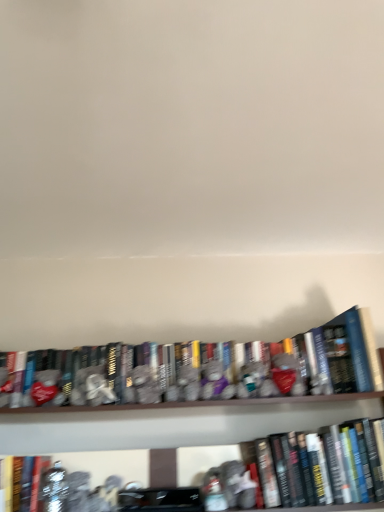
What do you see at coordinates (24, 479) in the screenshot?
I see `hardcover book at lower left, placed as the 3th book when sorted from right to left` at bounding box center [24, 479].

The image size is (384, 512). Identify the location of hardcover books at center, which ranks as the 2th book in right-to-left order. (348, 356).

Find the location of a particular element. hardcover book at center, which appears as the first book when viewed from the right is located at coordinates (330, 453).

Can you confirm if hardcover book at center, which appears as the first book when viewed from the right, is bigger than hardcover book at lower left, marked as the first book in a left-to-right arrangement?

Correct, hardcover book at center, which appears as the first book when viewed from the right, is larger in size than hardcover book at lower left, marked as the first book in a left-to-right arrangement.

From their relative heights in the image, would you say hardcover book at center, the third book when ordered from left to right, is taller or shorter than hardcover book at lower left, marked as the first book in a left-to-right arrangement?

In the image, hardcover book at center, the third book when ordered from left to right, appears to be taller than hardcover book at lower left, marked as the first book in a left-to-right arrangement.

From a real-world perspective, does hardcover book at center, which appears as the first book when viewed from the right, sit lower than hardcover book at lower left, placed as the 3th book when sorted from right to left?

No.

From the image's perspective, would you say hardcover book at center, which appears as the first book when viewed from the right, is positioned over hardcover book at lower left, placed as the 3th book when sorted from right to left?

Yes, from the image's perspective, hardcover book at center, which appears as the first book when viewed from the right, is on top of hardcover book at lower left, placed as the 3th book when sorted from right to left.

From the picture: From the image's perspective, relative to hardcover books at center, which ranks as the 2th book in right-to-left order, is hardcover book at center, the third book when ordered from left to right, above or below?

From the image's perspective, hardcover book at center, the third book when ordered from left to right, appears below hardcover books at center, which ranks as the 2th book in right-to-left order.

Who is taller, hardcover book at center, which appears as the first book when viewed from the right, or hardcover books at center, the second book from the left?

hardcover book at center, which appears as the first book when viewed from the right.

Is hardcover book at center, the third book when ordered from left to right, facing towards hardcover books at center, the second book from the left?

No, hardcover book at center, the third book when ordered from left to right, is not oriented towards hardcover books at center, the second book from the left.

Between hardcover book at center, the third book when ordered from left to right, and hardcover books at center, which ranks as the 2th book in right-to-left order, which one appears on the right side from the viewer's perspective?

From the viewer's perspective, hardcover book at center, the third book when ordered from left to right, appears more on the right side.

Is hardcover book at lower left, marked as the first book in a left-to-right arrangement, positioned before hardcover books at center, which ranks as the 2th book in right-to-left order?

Yes, it is.

Is hardcover book at lower left, marked as the first book in a left-to-right arrangement, beside hardcover books at center, the second book from the left?

No, hardcover book at lower left, marked as the first book in a left-to-right arrangement, is not in contact with hardcover books at center, the second book from the left.

Where is `the 2nd book behind when counting from the hardcover book at lower left, placed as the 3th book when sorted from right to left`? The height and width of the screenshot is (512, 384). the 2nd book behind when counting from the hardcover book at lower left, placed as the 3th book when sorted from right to left is located at coordinates (348, 356).

From the image's perspective, is hardcover book at lower left, marked as the first book in a left-to-right arrangement, located beneath hardcover book at center, the third book when ordered from left to right?

Indeed, from the image's perspective, hardcover book at lower left, marked as the first book in a left-to-right arrangement, is shown beneath hardcover book at center, the third book when ordered from left to right.

Would you say hardcover book at lower left, marked as the first book in a left-to-right arrangement, is a long distance from hardcover book at center, which appears as the first book when viewed from the right?

hardcover book at lower left, marked as the first book in a left-to-right arrangement, is actually quite close to hardcover book at center, which appears as the first book when viewed from the right.

At what (x,y) coordinates should I click in order to perform the action: click on book below the hardcover book at center, the third book when ordered from left to right (from a real-world perspective). Please return your answer as a coordinate pair (x, y). Looking at the image, I should click on (24, 479).

Which is farther, (18, 498) or (339, 478)?

Positioned behind is point (339, 478).

Is there a large distance between hardcover books at center, the second book from the left, and hardcover book at lower left, placed as the 3th book when sorted from right to left?

No, there isn't a large distance between hardcover books at center, the second book from the left, and hardcover book at lower left, placed as the 3th book when sorted from right to left.

Does hardcover books at center, which ranks as the 2th book in right-to-left order, have a smaller size compared to hardcover book at lower left, placed as the 3th book when sorted from right to left?

Incorrect, hardcover books at center, which ranks as the 2th book in right-to-left order, is not smaller in size than hardcover book at lower left, placed as the 3th book when sorted from right to left.

Is hardcover books at center, the second book from the left, oriented towards hardcover book at center, the third book when ordered from left to right?

No.

Considering the positions of objects hardcover books at center, which ranks as the 2th book in right-to-left order, and hardcover book at center, the third book when ordered from left to right, in the image provided, who is more to the right, hardcover books at center, which ranks as the 2th book in right-to-left order, or hardcover book at center, the third book when ordered from left to right,?

hardcover book at center, the third book when ordered from left to right, is more to the right.

Is hardcover books at center, which ranks as the 2th book in right-to-left order, thinner than hardcover book at center, which appears as the first book when viewed from the right?

No.

You are a GUI agent. You are given a task and a screenshot of the screen. Output one action in this format:
    pyautogui.click(x=<x>, y=<y>)
    Task: Click on the book that is the 1st one above the hardcover book at lower left, marked as the first book in a left-to-right arrangement (from a real-world perspective)
    The width and height of the screenshot is (384, 512).
    Given the screenshot: What is the action you would take?
    (330, 453)

Find the location of a particular element. The width and height of the screenshot is (384, 512). the 1st book below the hardcover books at center, which ranks as the 2th book in right-to-left order (from the image's perspective) is located at coordinates coord(330,453).

Based on their spatial positions, is hardcover book at center, the third book when ordered from left to right, or hardcover book at lower left, marked as the first book in a left-to-right arrangement, closer to hardcover books at center, the second book from the left?

hardcover book at center, the third book when ordered from left to right, is positioned closer to the anchor hardcover books at center, the second book from the left.

Estimate the real-world distances between objects in this image. Which object is further from hardcover books at center, which ranks as the 2th book in right-to-left order, hardcover book at lower left, marked as the first book in a left-to-right arrangement, or hardcover book at center, which appears as the first book when viewed from the right?

hardcover book at lower left, marked as the first book in a left-to-right arrangement, is positioned further to the anchor hardcover books at center, which ranks as the 2th book in right-to-left order.

Estimate the real-world distances between objects in this image. Which object is closer to hardcover book at center, the third book when ordered from left to right, hardcover book at lower left, placed as the 3th book when sorted from right to left, or hardcover books at center, the second book from the left?

hardcover books at center, the second book from the left, is positioned closer to the anchor hardcover book at center, the third book when ordered from left to right.

Considering their positions, is hardcover book at center, which appears as the first book when viewed from the right, positioned further to hardcover book at lower left, placed as the 3th book when sorted from right to left, than hardcover books at center, which ranks as the 2th book in right-to-left order?

hardcover book at center, which appears as the first book when viewed from the right.

Looking at this image, considering their positions, is hardcover books at center, the second book from the left, positioned further to hardcover book at lower left, marked as the first book in a left-to-right arrangement, than hardcover book at center, the third book when ordered from left to right?

hardcover book at center, the third book when ordered from left to right, is further to hardcover book at lower left, marked as the first book in a left-to-right arrangement.

Looking at the image, which one is located further to hardcover book at center, which appears as the first book when viewed from the right, hardcover books at center, which ranks as the 2th book in right-to-left order, or hardcover book at lower left, marked as the first book in a left-to-right arrangement?

hardcover book at lower left, marked as the first book in a left-to-right arrangement, is further to hardcover book at center, which appears as the first book when viewed from the right.

Locate an element on the screen. Image resolution: width=384 pixels, height=512 pixels. book located between hardcover book at lower left, placed as the 3th book when sorted from right to left, and hardcover book at center, which appears as the first book when viewed from the right, in the left-right direction is located at coordinates (348, 356).